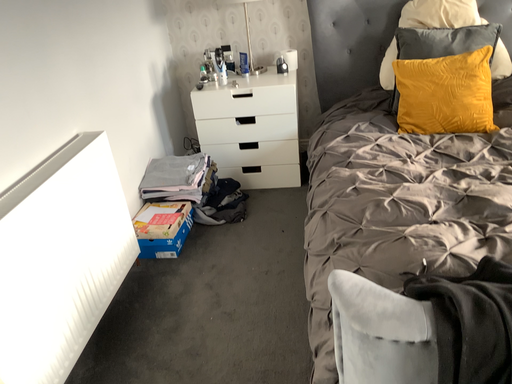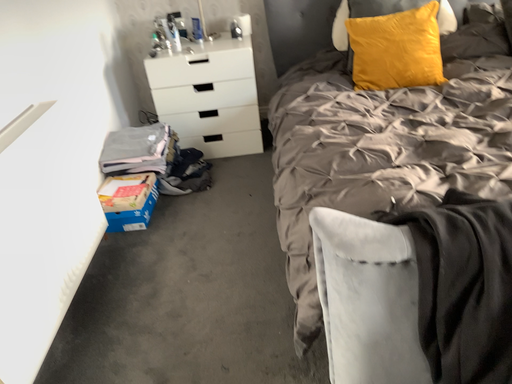
Question: Which way did the camera rotate in the video?

Choices:
 (A) rotated left
 (B) rotated right

Answer: (B)